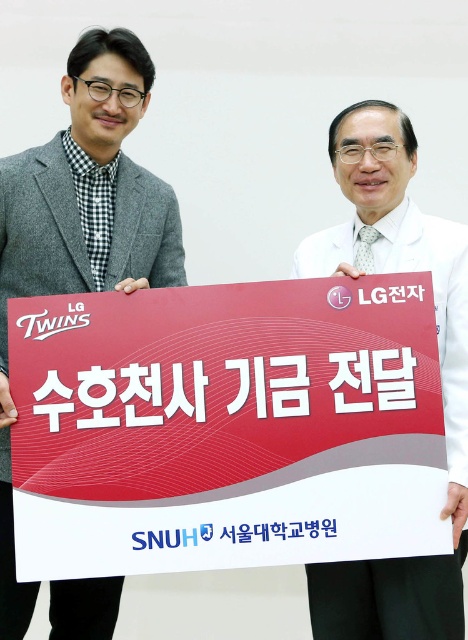
Question: Which of the following is the farthest from the observer?

Choices:
 (A) (67, 317)
 (B) (12, 596)

Answer: (B)

Question: Where is red paper sign at center located in relation to white lab coat at center in the image?

Choices:
 (A) above
 (B) below

Answer: (B)

Question: Which object is farther from the camera taking this photo?

Choices:
 (A) white lab coat at center
 (B) red paper sign at center
 (C) matte gray blazer at left

Answer: (C)

Question: Which point is farther to the camera?

Choices:
 (A) red paper sign at center
 (B) white lab coat at center

Answer: (B)

Question: Considering the relative positions of red paper sign at center and matte gray blazer at left in the image provided, where is red paper sign at center located with respect to matte gray blazer at left?

Choices:
 (A) left
 (B) right

Answer: (B)

Question: Does matte gray blazer at left have a smaller size compared to white lab coat at center?

Choices:
 (A) no
 (B) yes

Answer: (A)